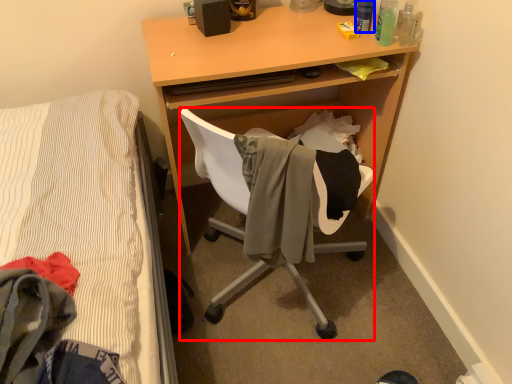
Question: Which object appears closest to the camera in this image, chair (highlighted by a red box) or bottle (highlighted by a blue box)?

Choices:
 (A) chair
 (B) bottle

Answer: (A)